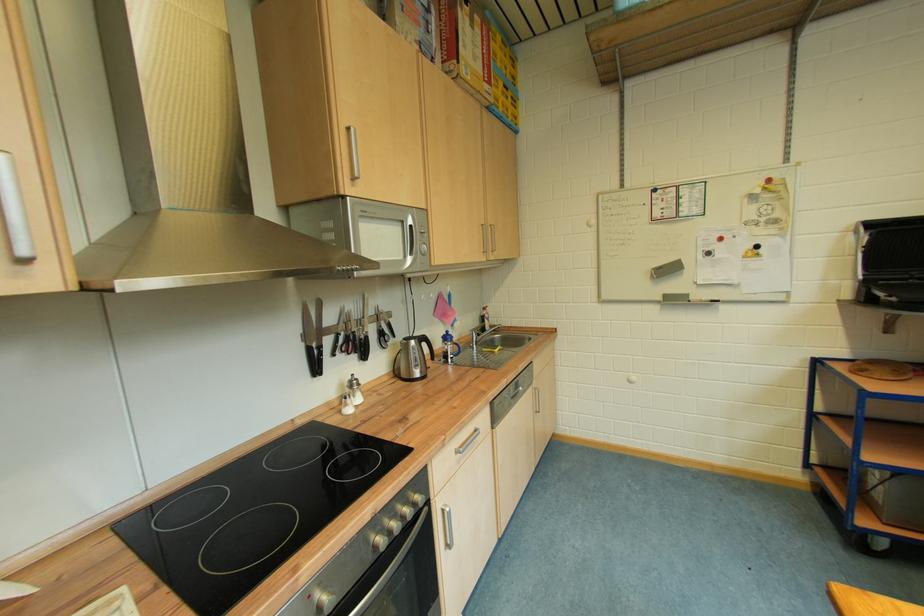
Describe the element at coordinates (480, 333) in the screenshot. I see `the faucet handle` at that location.